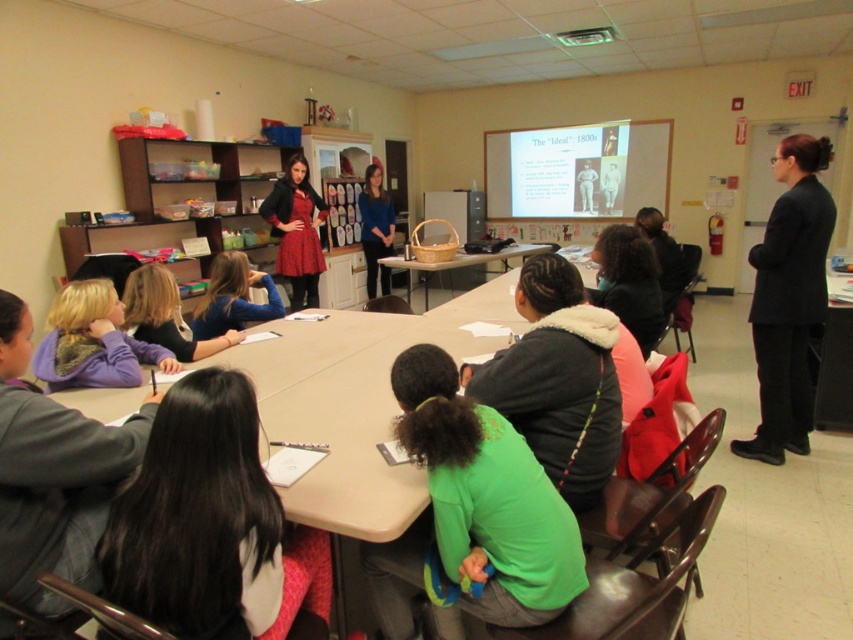
You are a student sitting at the wooden table at center. You want to look at the matte white slide at upper center. Which direction should you move your head to see it better?

The matte white slide at upper center is further to the viewer than the wooden table at center, so you should move your head forward to see it better.

You are standing at the center of the classroom. You need to place a new poster exactly where the black matte suit at right is currently located. What are the coordinates for placing the poster?

The coordinates for placing the poster should be at point (788, 298), which is where the black matte suit at right is located.